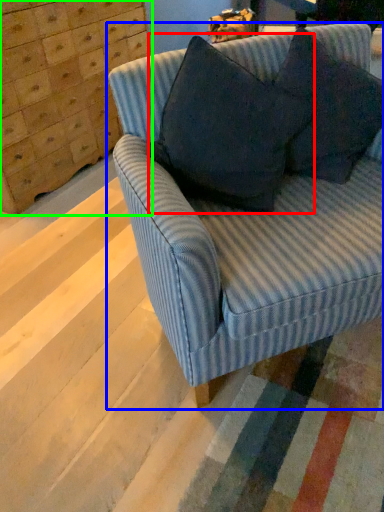
Question: Which object is positioned farthest from throw pillow (highlighted by a red box)? Select from studio couch (highlighted by a blue box) and dresser (highlighted by a green box).

Choices:
 (A) studio couch
 (B) dresser

Answer: (B)